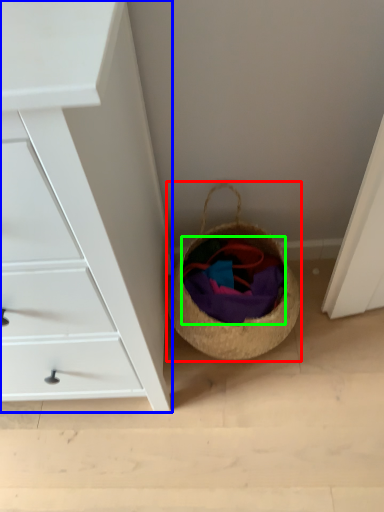
Question: Estimate the real-world distances between objects in this image. Which object is closer to basket (highlighted by a red box), chest of drawers (highlighted by a blue box) or clothing (highlighted by a green box)?

Choices:
 (A) chest of drawers
 (B) clothing

Answer: (B)